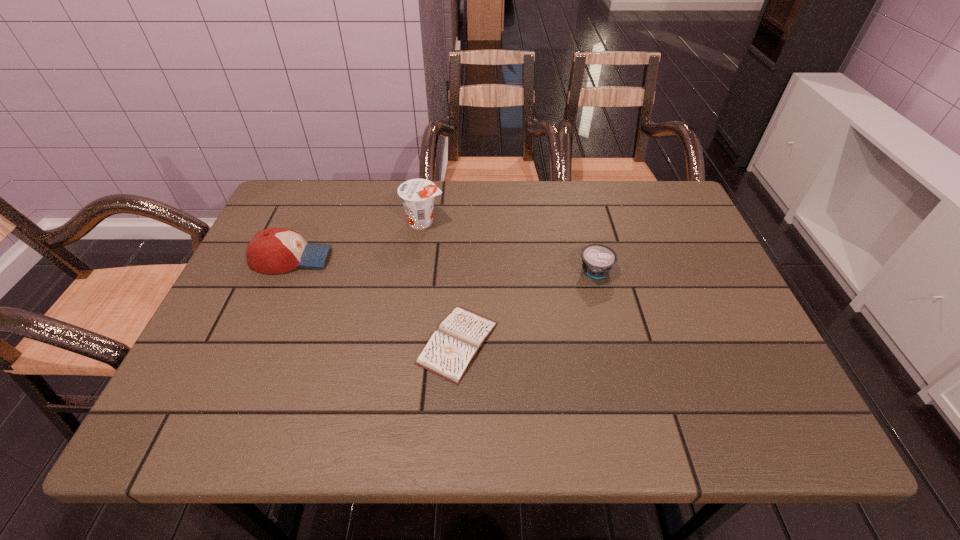
The height and width of the screenshot is (540, 960). I want to click on vacant space located on the front of the third tallest object, so click(x=636, y=433).

Locate an element on the screen. The width and height of the screenshot is (960, 540). vacant position located on the right of the diary is located at coordinates (628, 343).

Where is `object at the far edge`? object at the far edge is located at coordinates (417, 195).

You are a GUI agent. You are given a task and a screenshot of the screen. Output one action in this format:
    pyautogui.click(x=<x>, y=<y>)
    Task: Click on the object that is at the left edge
    
    Given the screenshot: What is the action you would take?
    pyautogui.click(x=275, y=250)

This screenshot has height=540, width=960. In order to click on free spot at the far edge of the desktop in this screenshot , I will do `click(460, 229)`.

Locate an element on the screen. vacant space at the near edge of the desktop is located at coordinates (703, 404).

Locate an element on the screen. This screenshot has height=540, width=960. free spot at the left edge of the desktop is located at coordinates (264, 326).

In the image, there is a desktop. At what (x,y) coordinates should I click in order to perform the action: click on vacant space at the right edge. Please return your answer as a coordinate pair (x, y). Image resolution: width=960 pixels, height=540 pixels. Looking at the image, I should click on click(x=717, y=288).

What are the coordinates of `free region at the near left corner` in the screenshot? It's located at (210, 438).

Find the location of a particular element. The width and height of the screenshot is (960, 540). unoccupied position between the leftmost object and the nearer yogurt is located at coordinates (444, 265).